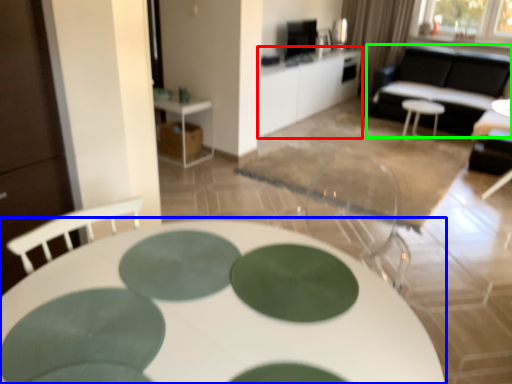
Question: Estimate the real-world distances between objects in this image. Which object is farther from table (highlighted by a red box), table (highlighted by a blue box) or couch (highlighted by a green box)?

Choices:
 (A) table
 (B) couch

Answer: (A)